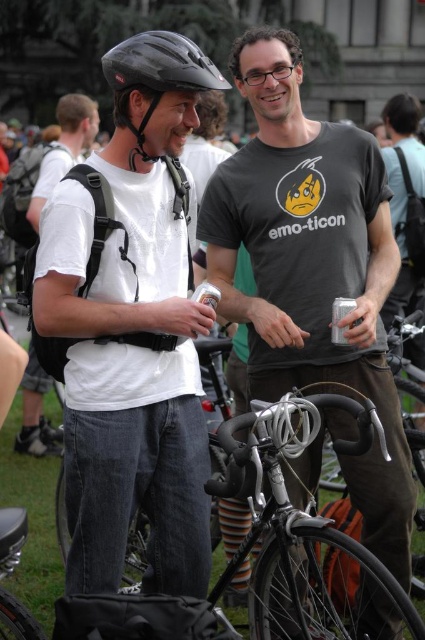
Between dark gray t-shirt with graphic at center and transparent plastic goggles at upper center, which one is positioned lower?

dark gray t-shirt with graphic at center is below.

Does dark gray t-shirt with graphic at center have a smaller size compared to transparent plastic goggles at upper center?

Actually, dark gray t-shirt with graphic at center might be larger than transparent plastic goggles at upper center.

Does point (214, 275) come closer to viewer compared to point (257, 68)?

No, (214, 275) is further to viewer.

Identify the location of dark gray t-shirt with graphic at center. (312, 273).

Who is shorter, white matte t-shirt at left or black matte bicycle helmet at upper left?

With less height is black matte bicycle helmet at upper left.

Identify the location of white matte t-shirt at left. (64, 148).

What do you see at coordinates (133, 330) in the screenshot?
I see `matte white t-shirt at center` at bounding box center [133, 330].

Is matte white t-shirt at center positioned in front of black matte bicycle helmet at upper left?

That is False.

What do you see at coordinates (133, 330) in the screenshot? I see `matte white t-shirt at center` at bounding box center [133, 330].

What are the coordinates of `matte white t-shirt at center` in the screenshot? It's located at (133, 330).